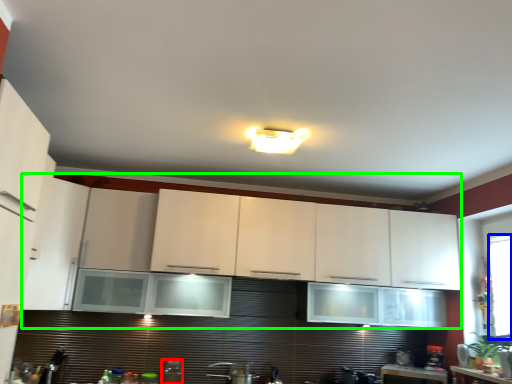
Question: Which object is positioned closest to appliance (highlighted by a red box)? Select from window screen (highlighted by a blue box) and cabinetry (highlighted by a green box).

Choices:
 (A) window screen
 (B) cabinetry

Answer: (B)